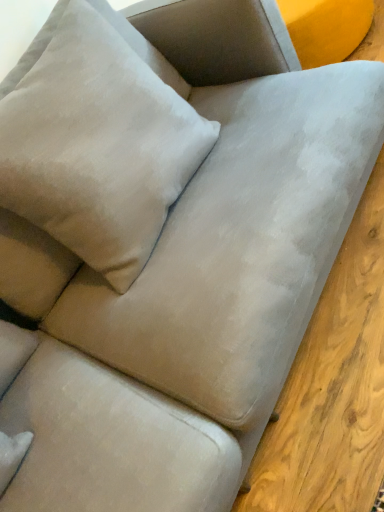
Locate an element on the screen. The image size is (384, 512). velvet beige pillow at upper left is located at coordinates pyautogui.click(x=98, y=139).

Describe the element at coordinates (98, 139) in the screenshot. I see `velvet beige pillow at upper left` at that location.

This screenshot has height=512, width=384. I want to click on velvet beige pillow at upper left, so click(x=98, y=139).